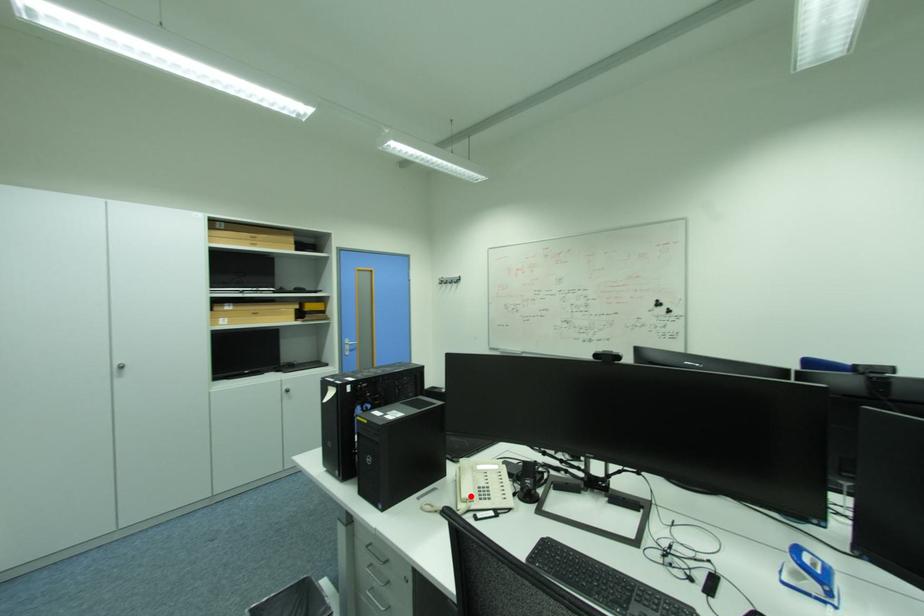
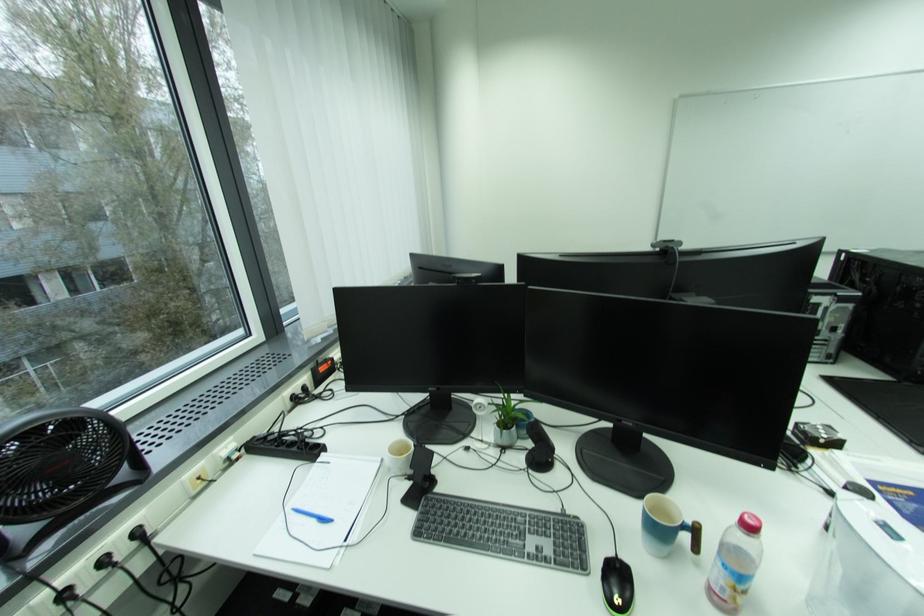
Question: I am providing you with two images of the same scene from different viewpoints. A red point is marked on the first image. At the location where the point appears in image 1, is it still visible in image 2?

Choices:
 (A) Yes
 (B) No

Answer: (B)